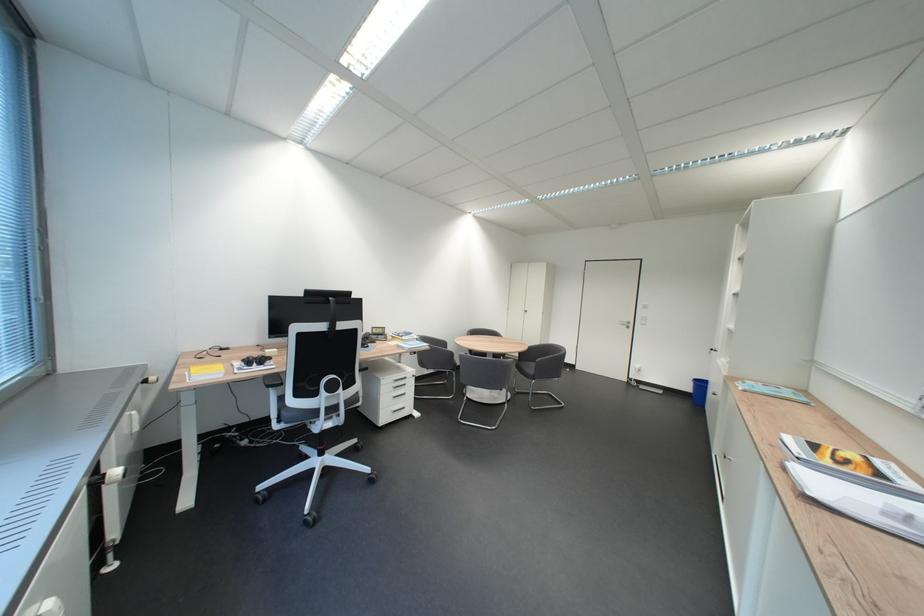
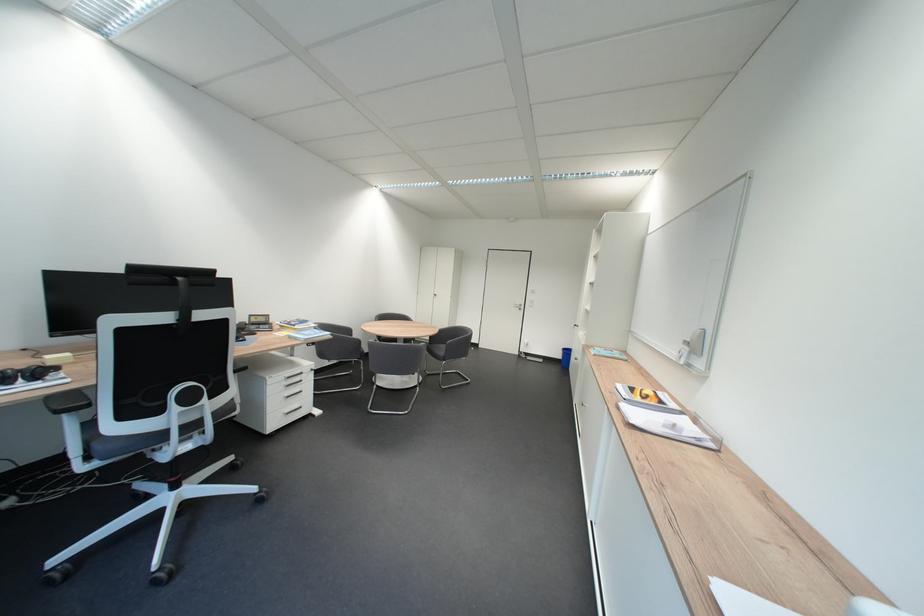
Locate, in the second image, the point that corresponds to [654,389] in the first image.

(541, 360)